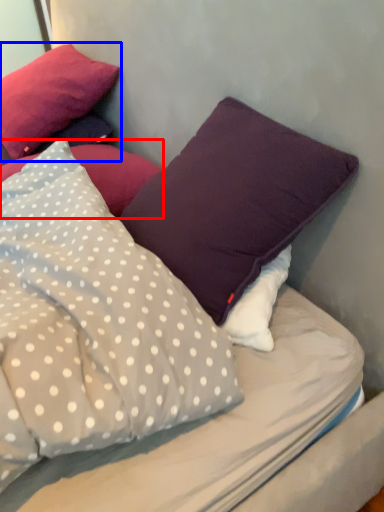
Question: Among these objects, which one is farthest to the camera, pillow (highlighted by a red box) or pillow (highlighted by a blue box)?

Choices:
 (A) pillow
 (B) pillow

Answer: (B)